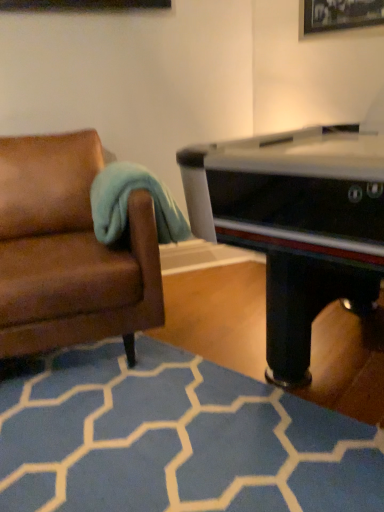
Question: Is teal soft fabric at left behind brown leather couch at left?

Choices:
 (A) yes
 (B) no

Answer: (A)

Question: Are teal soft fabric at left and brown leather couch at left far apart?

Choices:
 (A) yes
 (B) no

Answer: (B)

Question: Is teal soft fabric at left facing towards brown leather couch at left?

Choices:
 (A) yes
 (B) no

Answer: (A)

Question: Is teal soft fabric at left thinner than brown leather couch at left?

Choices:
 (A) no
 (B) yes

Answer: (B)

Question: Considering the relative sizes of teal soft fabric at left and brown leather couch at left in the image provided, is teal soft fabric at left smaller than brown leather couch at left?

Choices:
 (A) yes
 (B) no

Answer: (A)

Question: Does teal soft fabric at left lie in front of brown leather couch at left?

Choices:
 (A) no
 (B) yes

Answer: (A)

Question: Is blue carpet at lower center oriented towards teal soft fabric at left?

Choices:
 (A) no
 (B) yes

Answer: (A)

Question: Is blue carpet at lower center far from teal soft fabric at left?

Choices:
 (A) no
 (B) yes

Answer: (A)

Question: Does blue carpet at lower center have a greater height compared to teal soft fabric at left?

Choices:
 (A) yes
 (B) no

Answer: (B)

Question: From the image's perspective, is blue carpet at lower center under teal soft fabric at left?

Choices:
 (A) yes
 (B) no

Answer: (A)

Question: From a real-world perspective, is blue carpet at lower center physically above teal soft fabric at left?

Choices:
 (A) no
 (B) yes

Answer: (A)

Question: Is blue carpet at lower center positioned beyond the bounds of teal soft fabric at left?

Choices:
 (A) yes
 (B) no

Answer: (A)

Question: Is blue carpet at lower center bigger than brown leather couch at left?

Choices:
 (A) yes
 (B) no

Answer: (B)